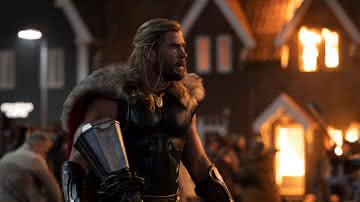
Locate an element on the screen. lit windows is located at coordinates (290, 153), (336, 135), (351, 132), (328, 50), (312, 46), (286, 51), (228, 51), (203, 52).